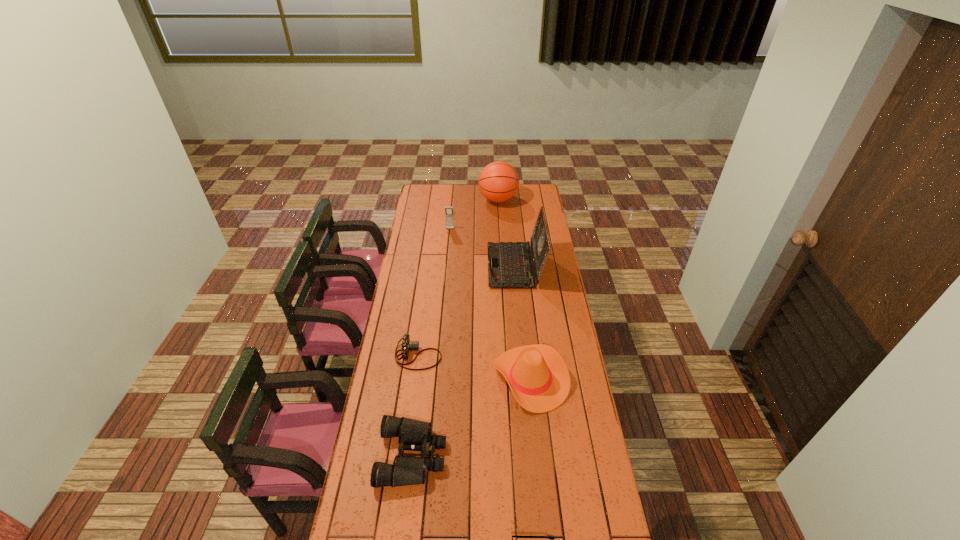
In the image, there is a desktop. In order to click on vacant area at the far edge in this screenshot , I will do `click(445, 201)`.

At what (x,y) coordinates should I click in order to perform the action: click on vacant space at the left edge of the desktop. Please return your answer as a coordinate pair (x, y). Looking at the image, I should click on (415, 289).

In the image, there is a desktop. At what (x,y) coordinates should I click in order to perform the action: click on vacant space at the right edge. Please return your answer as a coordinate pair (x, y). The image size is (960, 540). Looking at the image, I should click on (545, 332).

Identify the location of vacant region at the far right corner of the desktop. (518, 191).

Locate an element on the screen. vacant area between the basketball and the second nearest object is located at coordinates (455, 328).

Identify the location of free spot between the camera and the cowboy hat. pyautogui.click(x=474, y=367).

Identify the location of unoccupied position between the cellular telephone and the second shortest object. (434, 292).

I want to click on empty space between the laptop computer and the cowboy hat, so click(x=522, y=322).

Identify the location of vacant region between the third farthest object and the farthest object. (507, 233).

Identify the location of free space between the cowboy hat and the sixth tallest object. (474, 367).